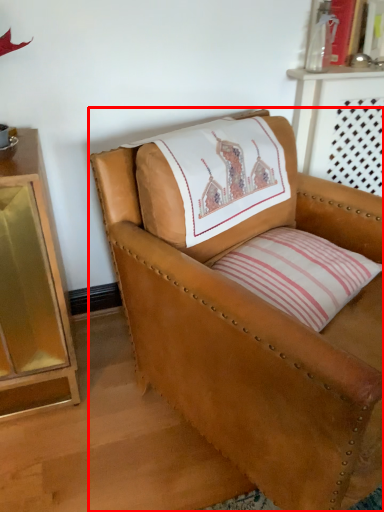
Question: Observing the image, what is the correct spatial positioning of chair (annotated by the red box) in reference to pillow?

Choices:
 (A) left
 (B) right

Answer: (A)